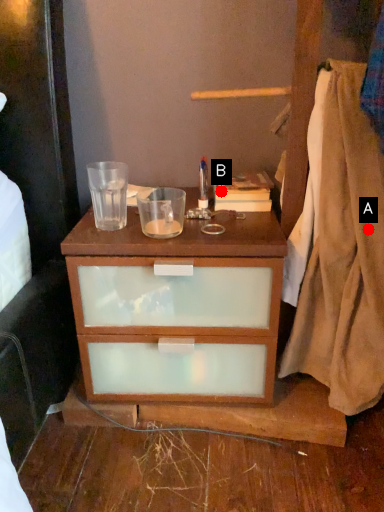
Question: Two points are circled on the image, labeled by A and B beside each circle. Which of the following is the closest to the observer?

Choices:
 (A) A is closer
 (B) B is closer

Answer: (A)